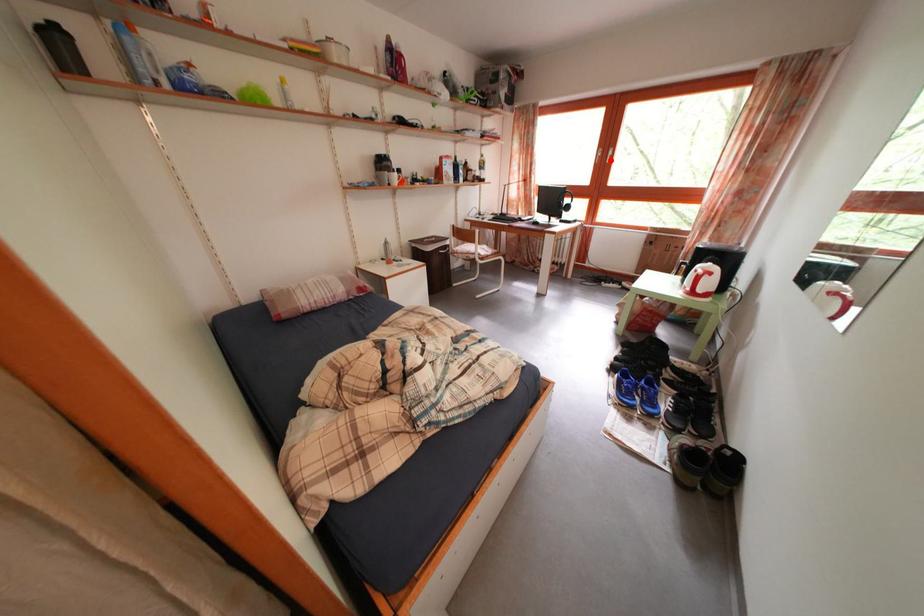
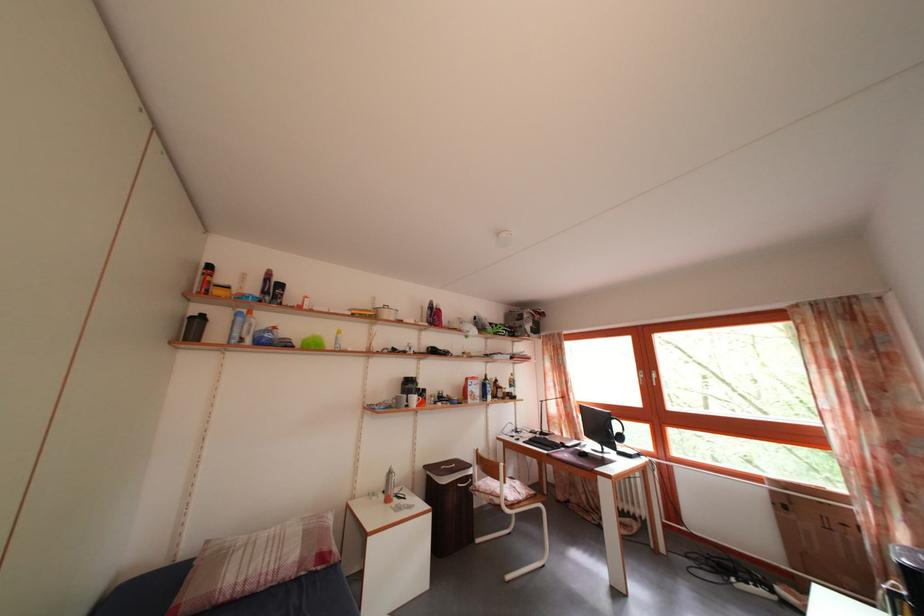
Question: I am providing you with two images of the same scene from different viewpoints. Image1 has a red point marked. In image2, the corresponding 3D location appears at what relative position? Reply with the corresponding letter.

Choices:
 (A) Closer
 (B) Farther

Answer: (B)